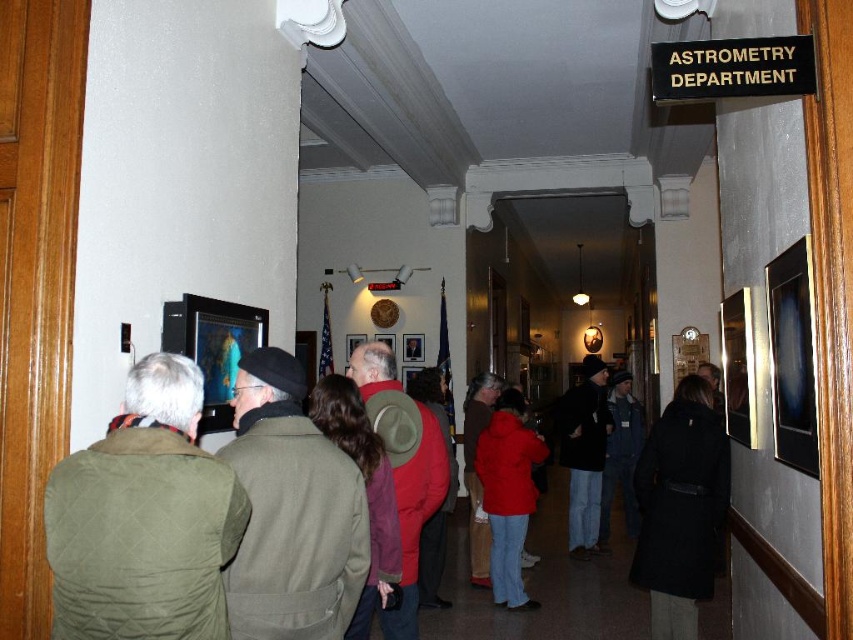
Is point (683, 499) positioned in front of point (521, 445)?

Yes, point (683, 499) is closer to viewer.

Does black wool coat at lower right have a lesser width compared to matte red jacket at center?

Indeed, black wool coat at lower right has a lesser width compared to matte red jacket at center.

Is point (691, 465) positioned behind point (537, 604)?

That is False.

The image size is (853, 640). What are the coordinates of `black wool coat at lower right` in the screenshot? It's located at (680, 508).

Does green quilted jacket at left appear over denim jacket at center?

Yes.

Between green quilted jacket at left and denim jacket at center, which one has less height?

Standing shorter between the two is green quilted jacket at left.

Who is more distant from viewer, (138, 566) or (622, 397)?

Positioned behind is point (622, 397).

Find the location of a particular element. The width and height of the screenshot is (853, 640). green quilted jacket at left is located at coordinates (144, 518).

Between point (498, 467) and point (415, 604), which one is positioned behind?

Positioned behind is point (498, 467).

Is matte red jacket at center in front of red woolen hat at center?

That is False.

Is point (519, 518) farther from camera compared to point (424, 413)?

That is True.

I want to click on matte red jacket at center, so click(x=508, y=492).